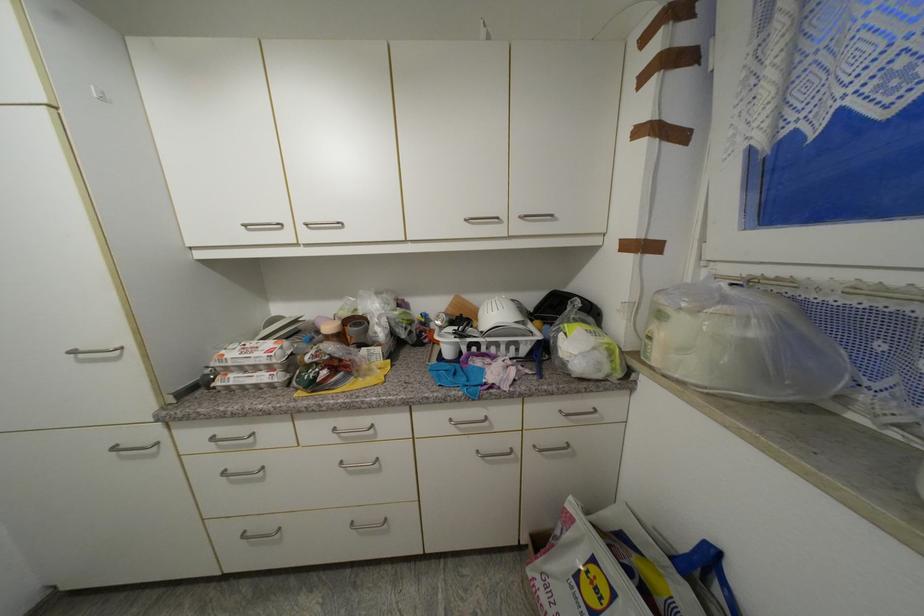
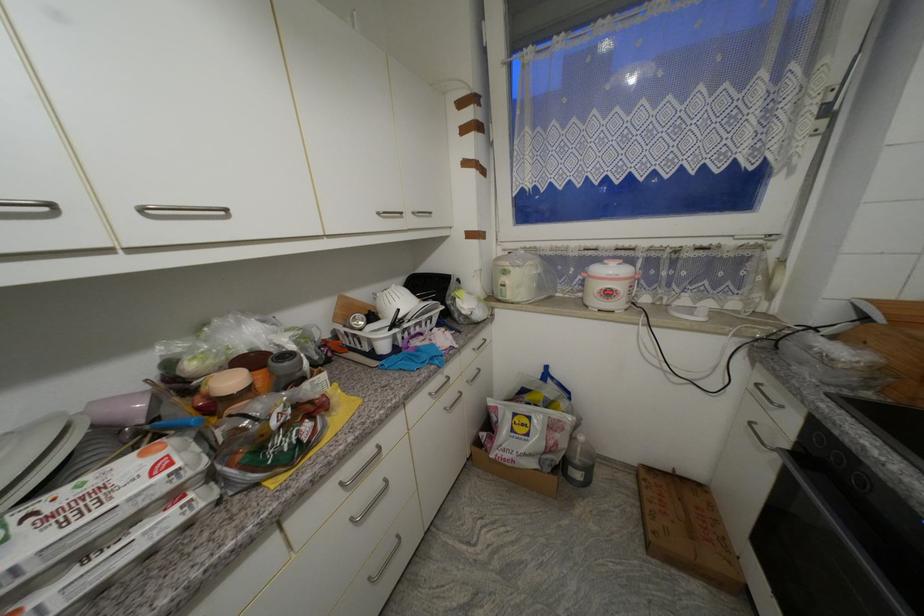
Find the pixel in the second image that matches pixel 470 222 in the first image.

(383, 215)